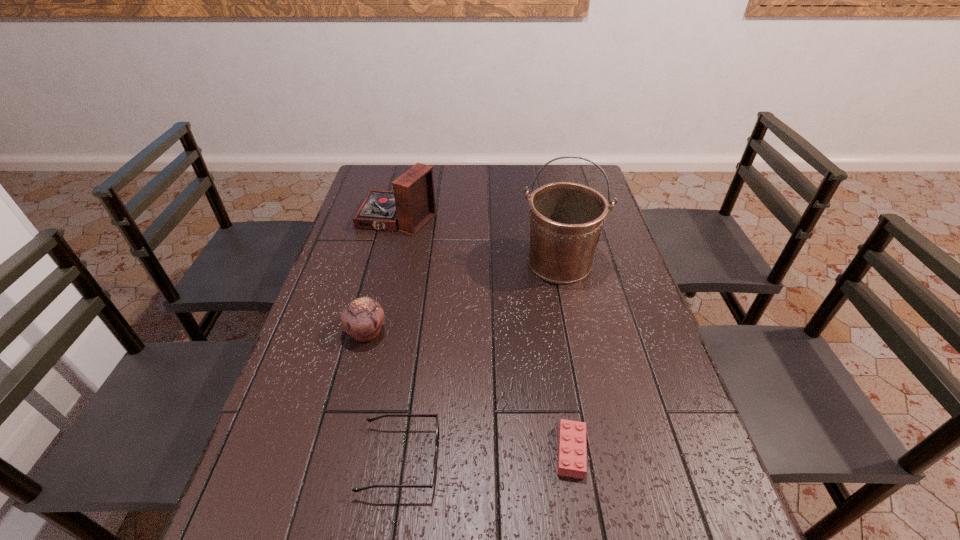
Identify the location of vacant position located 0.170m on the back of the shortest object. (557, 362).

Where is `phonograph record at the left edge`? phonograph record at the left edge is located at coordinates (411, 205).

Locate an element on the screen. muffin that is positioned at the left edge is located at coordinates (363, 318).

The image size is (960, 540). Identify the location of object present at the right edge. (566, 219).

The height and width of the screenshot is (540, 960). Identify the location of free location at the far edge. (464, 184).

The image size is (960, 540). Identify the location of free spot at the left edge of the desktop. (327, 443).

Image resolution: width=960 pixels, height=540 pixels. In order to click on free space at the right edge of the desktop in this screenshot , I will do `click(604, 306)`.

Where is `vacant space at the far right corner of the desktop`? The image size is (960, 540). vacant space at the far right corner of the desktop is located at coordinates (559, 170).

In order to click on free space between the Lego and the third shortest object in this screenshot , I will do `click(468, 392)`.

The height and width of the screenshot is (540, 960). What are the coordinates of `free spot between the Lego and the fourth tallest object` in the screenshot? It's located at coord(486,456).